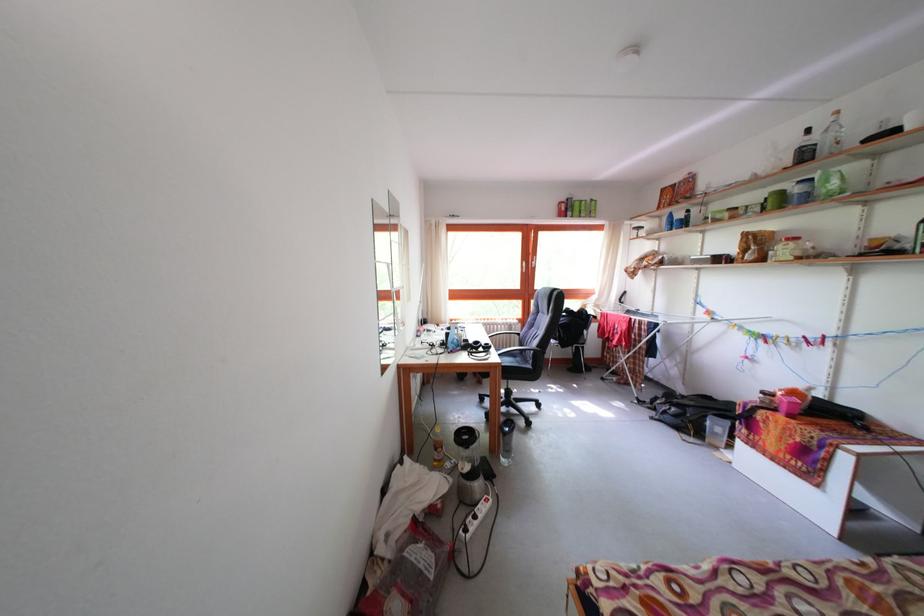
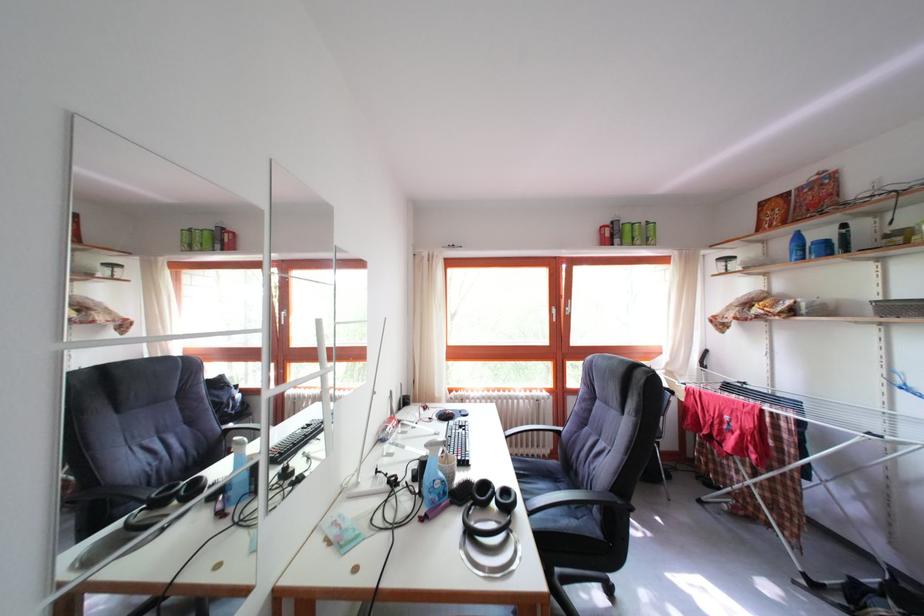
Question: The images are taken continuously from a first-person perspective. In which direction is your viewpoint rotating?

Choices:
 (A) Left
 (B) Right
 (C) Up
 (D) Down

Answer: (C)